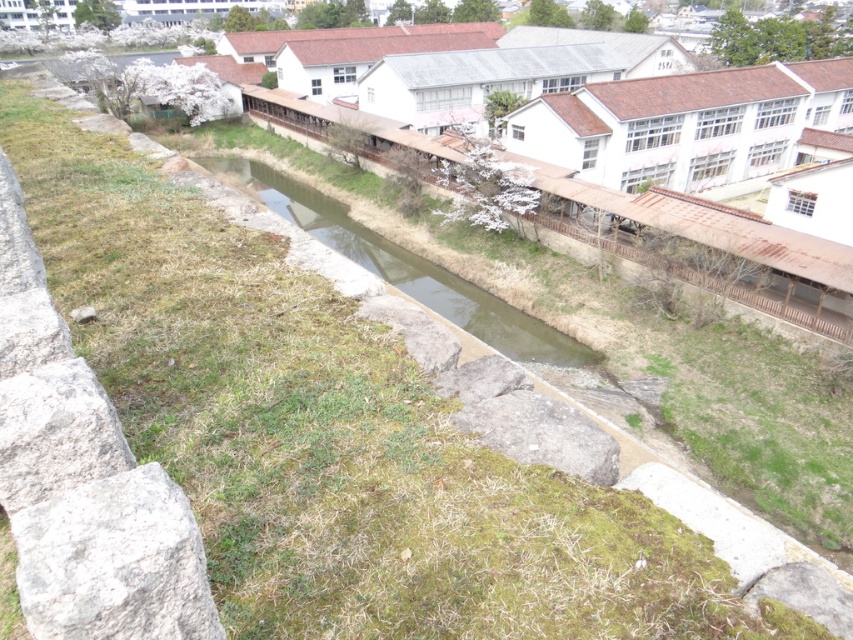
Question: In this image, where is gray rough stone at lower left located relative to green grassy stream at center?

Choices:
 (A) below
 (B) above

Answer: (A)

Question: Which object is farther from the camera taking this photo?

Choices:
 (A) green grassy stream at center
 (B) gray rough stone at lower left

Answer: (A)

Question: Is gray rough stone at lower left behind green grassy stream at center?

Choices:
 (A) no
 (B) yes

Answer: (A)

Question: Observing the image, what is the correct spatial positioning of gray rough stone at lower left in reference to green grassy stream at center?

Choices:
 (A) left
 (B) right

Answer: (B)

Question: Which of the following is the closest to the observer?

Choices:
 (A) tap(44, 566)
 (B) tap(520, 352)

Answer: (A)